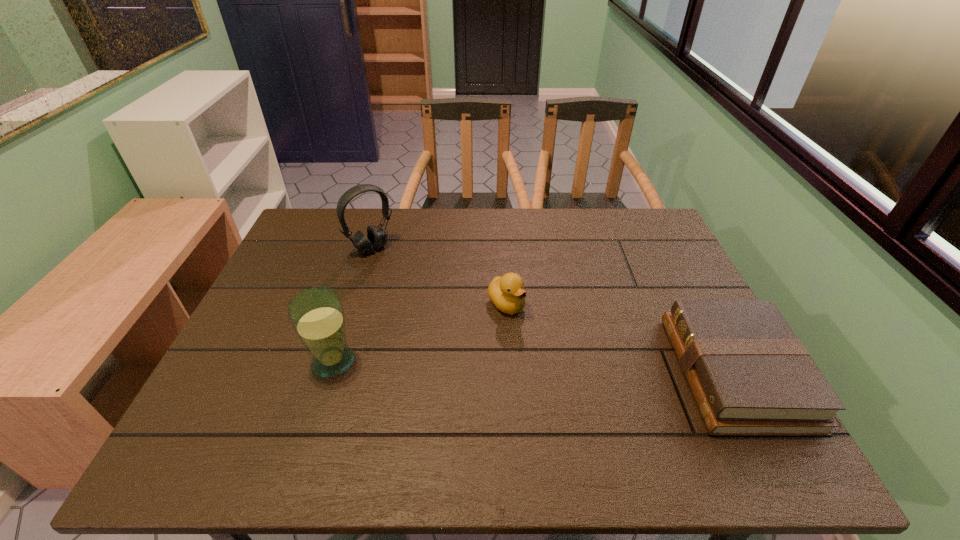
Locate an element on the screen. vacant space in between the second farthest object and the farthest object is located at coordinates (439, 276).

Identify the location of vacant space that is in between the third tallest object and the glass. click(420, 333).

Where is `free space that is in between the headset and the Bible`? The width and height of the screenshot is (960, 540). free space that is in between the headset and the Bible is located at coordinates (554, 310).

Find the location of a particular element. The image size is (960, 540). vacant area that lies between the second object from right to left and the glass is located at coordinates (420, 333).

Where is `vacant space that's between the Bible and the glass`? vacant space that's between the Bible and the glass is located at coordinates (535, 367).

Locate an element on the screen. The image size is (960, 540). vacant area that lies between the farthest object and the shortest object is located at coordinates (554, 310).

Locate an element on the screen. The width and height of the screenshot is (960, 540). empty space that is in between the rightmost object and the headset is located at coordinates (554, 310).

Identify which object is located as the nearest to the headset. Please provide its 2D coordinates. Your answer should be formatted as a tuple, i.e. [(x, y)], where the tuple contains the x and y coordinates of a point satisfying the conditions above.

[(507, 293)]

Identify the location of object that is the closest one to the farthest object. (507, 293).

I want to click on vacant region that satisfies the following two spatial constraints: 1. on the front side of the rightmost object; 2. on the spine side of the third nearest object, so click(x=510, y=373).